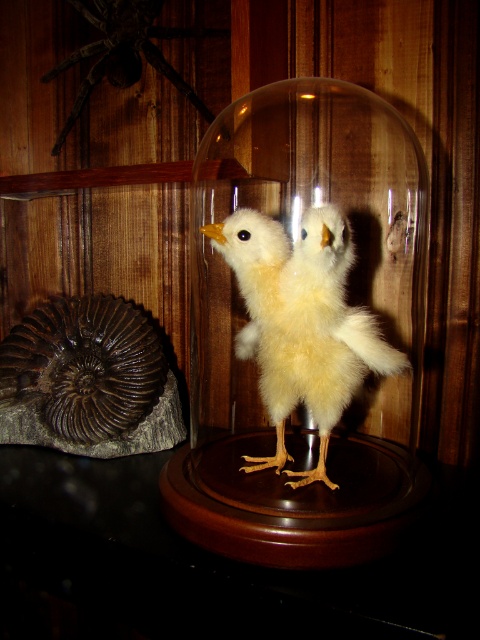
You are an interior designer arranging a display. You have a yellow fluffy chicken at center and a dark brown fuzzy spider at upper left. Which object is placed higher in the display setup?

The dark brown fuzzy spider at upper left is placed higher than the yellow fluffy chicken at center.

You are a photographer trying to capture a detailed image of the glass dome with baby chicks and the ammonite fossil. Your camera can focus on objects within a 25 inch range. Based on the scene, will the point at coordinates (262, 300) be in focus?

The point at coordinates (262, 300) is 31.25 inches from the camera, which is beyond the 25 inch focus range. Therefore, it will not be in focus.

You are an entomologist examining a display case. You see a yellow fluffy chicken at center and a dark brown fuzzy spider at upper left. Which object is positioned to the right of the other?

The yellow fluffy chicken at center is positioned to the right of the dark brown fuzzy spider at upper left.